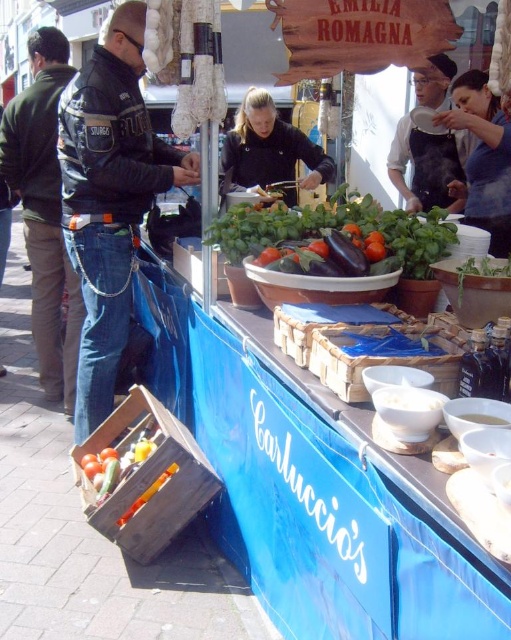
You are a customer at the market and want to place an order for a salad. The salad requires a carrot and a jacket to be placed on the table. However, you notice that the black matte jacket at center and the bright orange carrot at lower left are currently on the table. Can you determine which item has a larger width?

The black matte jacket at center has a larger width than the bright orange carrot at lower left according to the description.

You are a customer at the market and want to buy the bright orange carrot at lower left. However, you notice the black matte jacket at center is blocking your view of it. Can you determine which item is larger?

The black matte jacket at center is bigger than the bright orange carrot at lower left, so the jacket is larger.